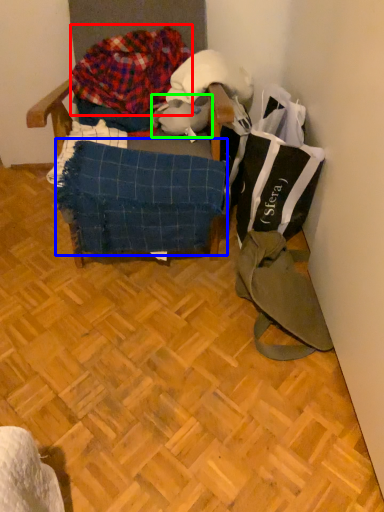
Question: Which object is positioned closest to waste (highlighted by a red box)? Select from blanket (highlighted by a blue box) and animal (highlighted by a green box).

Choices:
 (A) blanket
 (B) animal

Answer: (B)